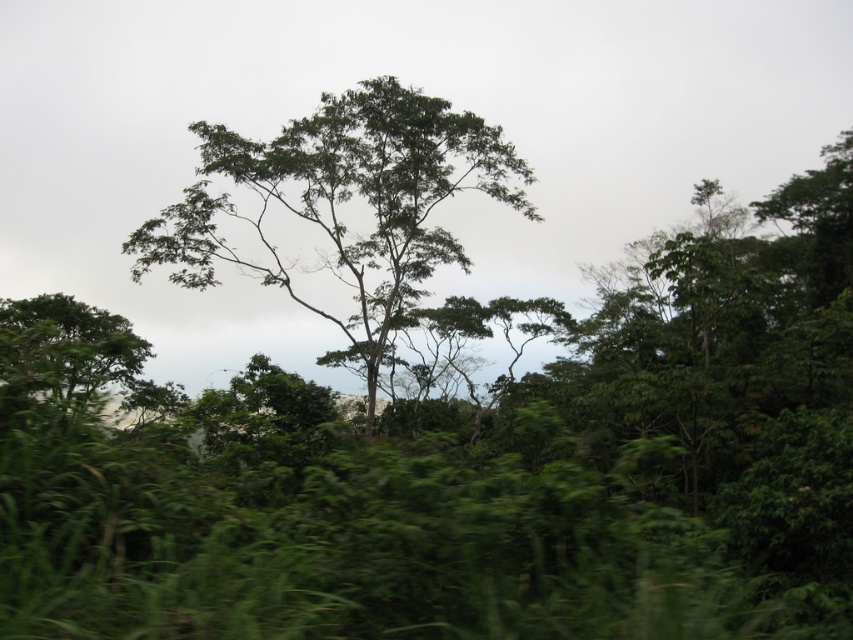
Between green leafy tree at center and green leafy tree at lower left, which one has more height?

green leafy tree at center is taller.

Is point (328, 195) positioned after point (59, 336)?

Yes, it is behind point (59, 336).

The height and width of the screenshot is (640, 853). In order to click on green leafy tree at center in this screenshot , I will do `click(343, 204)`.